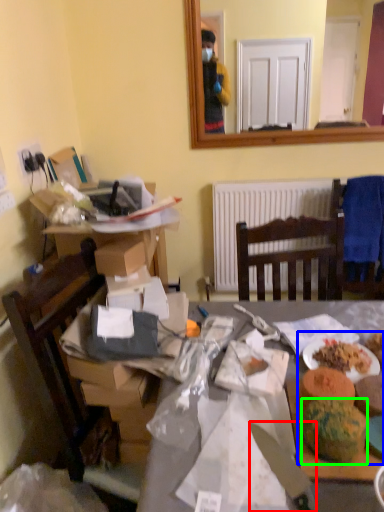
Question: Which is nearer to the knife (highlighted by a red box)? food (highlighted by a blue box) or watermelon (highlighted by a green box).

Choices:
 (A) food
 (B) watermelon

Answer: (B)